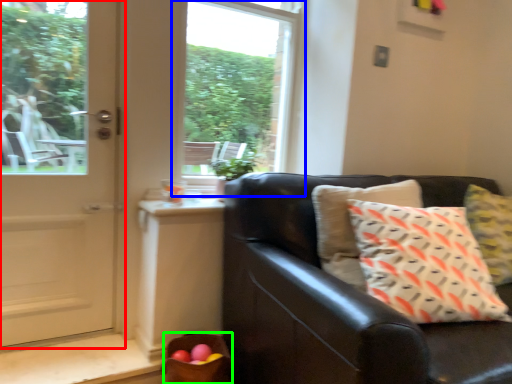
Question: Estimate the real-world distances between objects in this image. Which object is farther from door (highlighted by a red box), window (highlighted by a blue box) or basket (highlighted by a green box)?

Choices:
 (A) window
 (B) basket

Answer: (A)